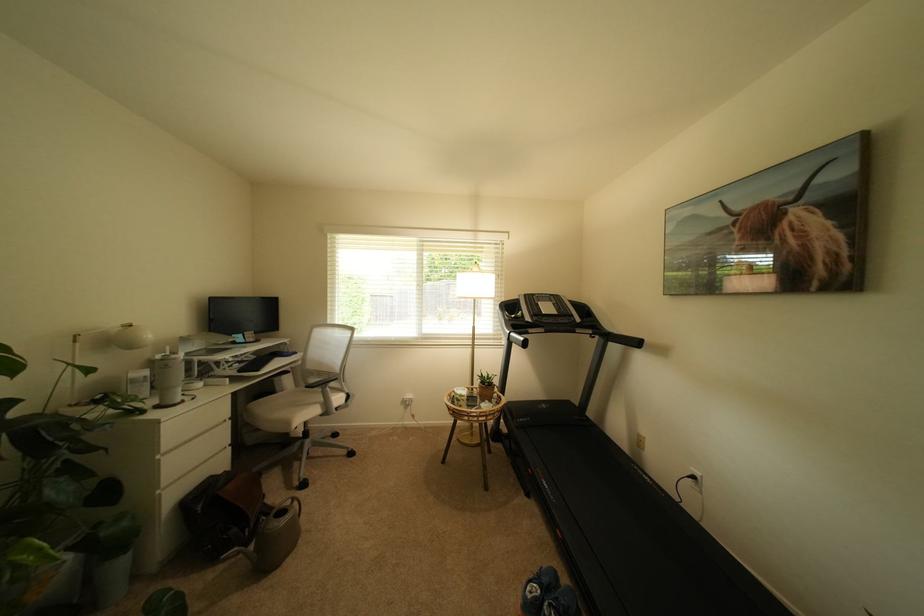
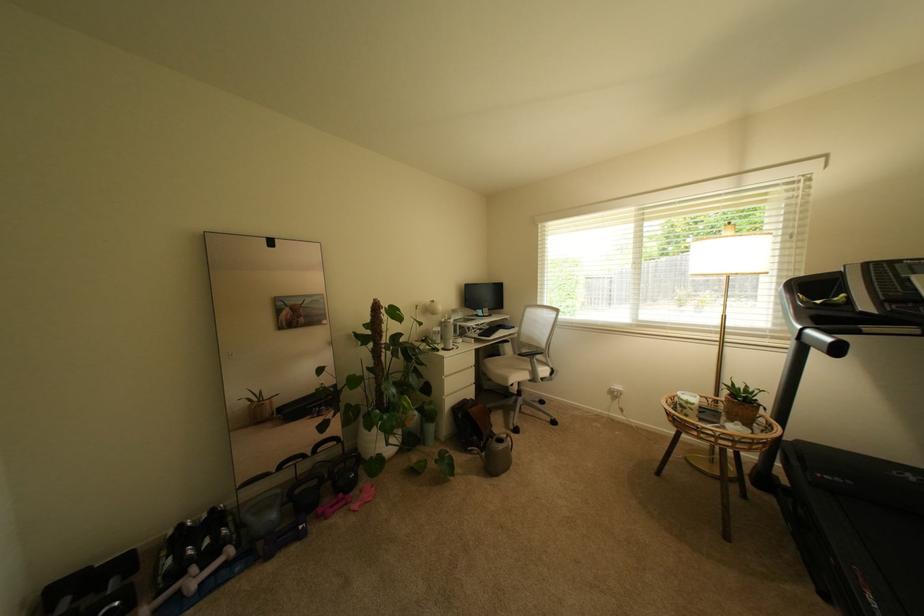
The point at (274, 505) is marked in the first image. Where is the corresponding point in the second image?

(500, 432)